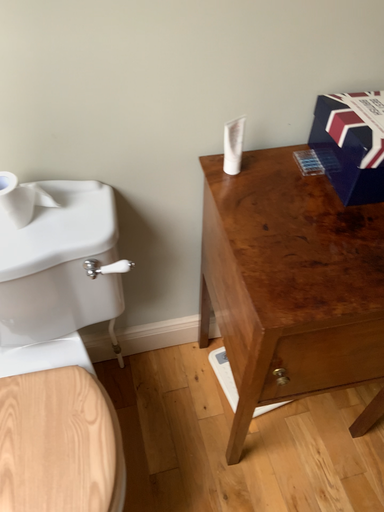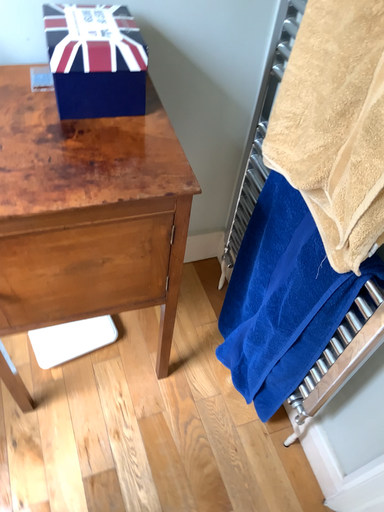
Question: How did the camera likely rotate when shooting the video?

Choices:
 (A) rotated right
 (B) rotated left

Answer: (A)